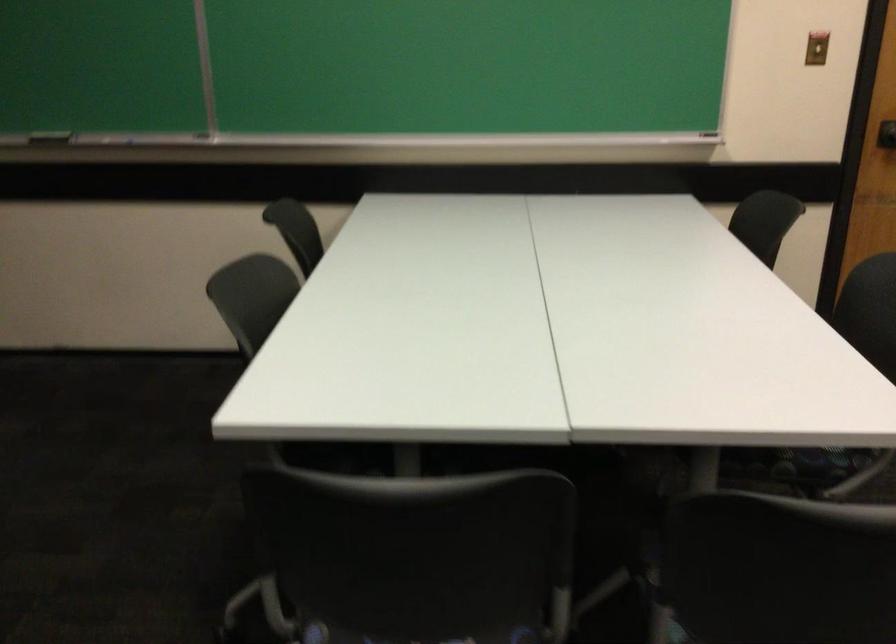
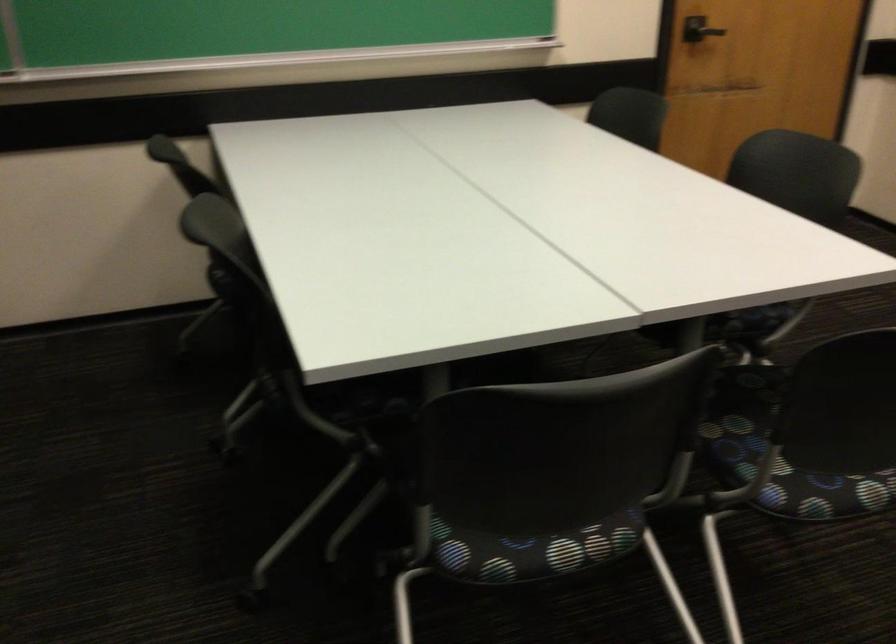
Question: Based on the continuous images, in which direction is the camera rotating? Reply with the corresponding letter.

Choices:
 (A) Left
 (B) Right
 (C) Up
 (D) Down

Answer: (B)